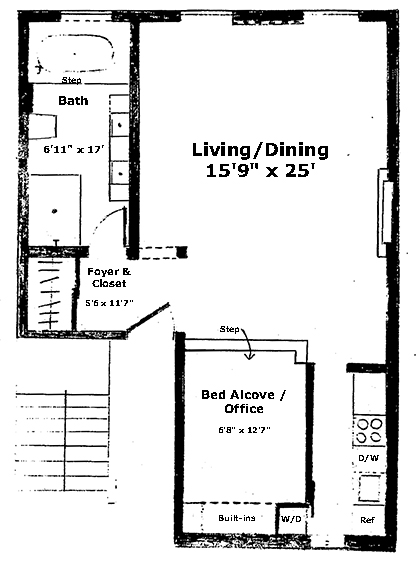
Find the location of a particular element. living space is located at coordinates (252, 441).